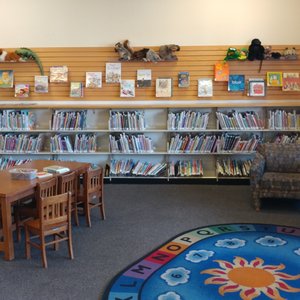
The image size is (300, 300). In order to click on tail of stuffed animal squirrel in this screenshot , I will do `click(125, 45)`.